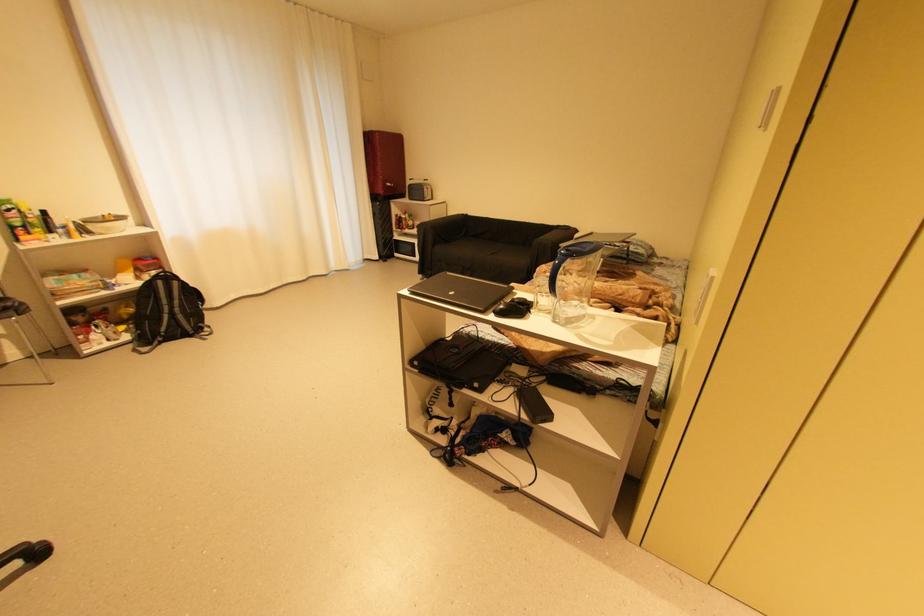
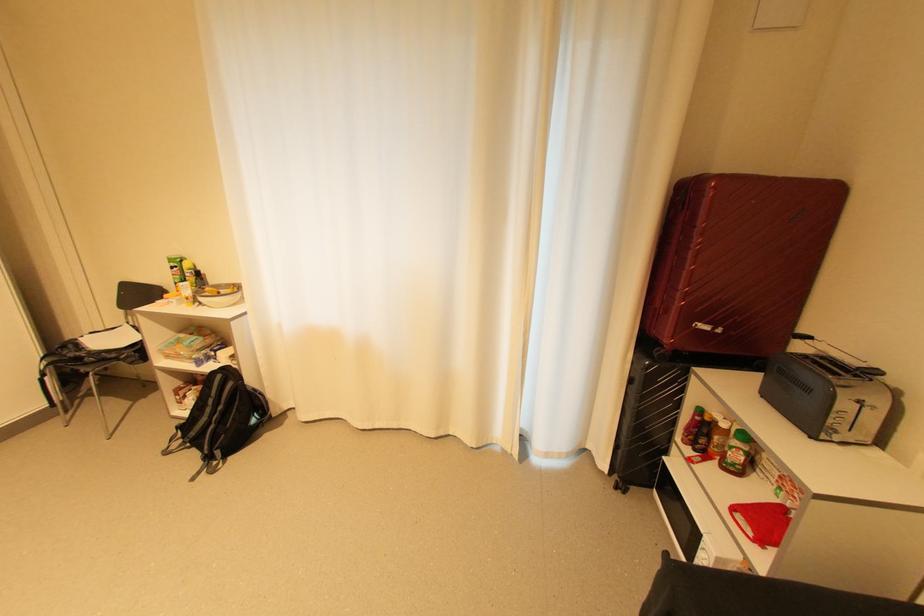
Find the pixel in the second image that matches [167,282] in the first image.

(226, 377)